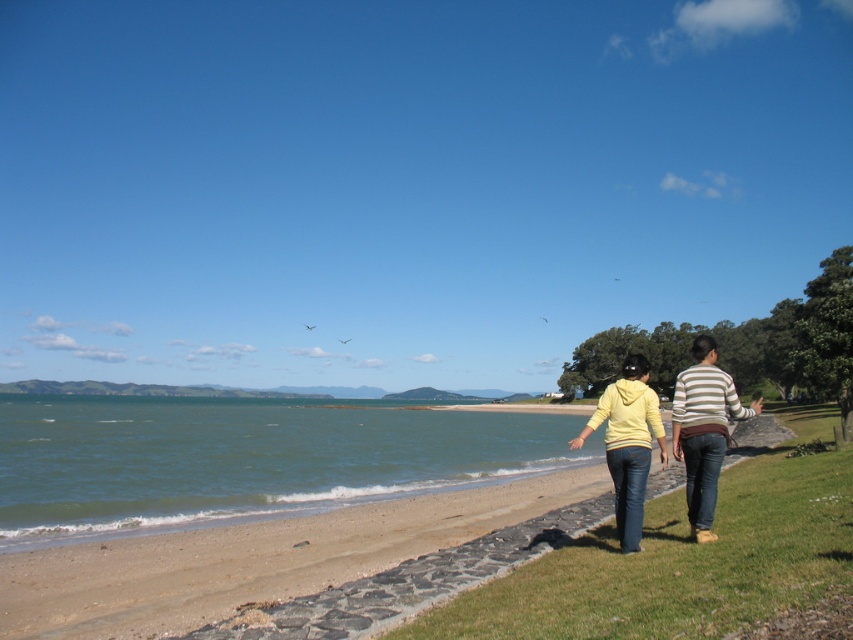
Is striped sweater at right behind yellow matte hoodie at lower right?

Yes, it is behind yellow matte hoodie at lower right.

Does point (711, 413) come farther from viewer compared to point (614, 445)?

No.

Find the location of a particular element. Image resolution: width=853 pixels, height=640 pixels. striped sweater at right is located at coordinates (704, 429).

Locate an element on the screen. This screenshot has height=640, width=853. striped sweater at right is located at coordinates (704, 429).

Does sandy beach at lower left appear on the right side of yellow matte hoodie at lower right?

No, sandy beach at lower left is not to the right of yellow matte hoodie at lower right.

Is sandy beach at lower left to the left of yellow matte hoodie at lower right from the viewer's perspective?

Correct, you'll find sandy beach at lower left to the left of yellow matte hoodie at lower right.

Which is in front, point (491, 557) or point (602, 394)?

Point (491, 557) is more forward.

Find the location of a particular element. sandy beach at lower left is located at coordinates (296, 566).

Identify the location of sandy beach at lower left. (296, 566).

Is sandy beach at lower left thinner than striped sweater at right?

No.

Is point (386, 616) positioned after point (721, 369)?

No.

You are a GUI agent. You are given a task and a screenshot of the screen. Output one action in this format:
    pyautogui.click(x=<x>, y=<y>)
    Task: Click on the sandy beach at lower left
    Image resolution: width=853 pixels, height=640 pixels.
    Given the screenshot: What is the action you would take?
    pyautogui.click(x=296, y=566)